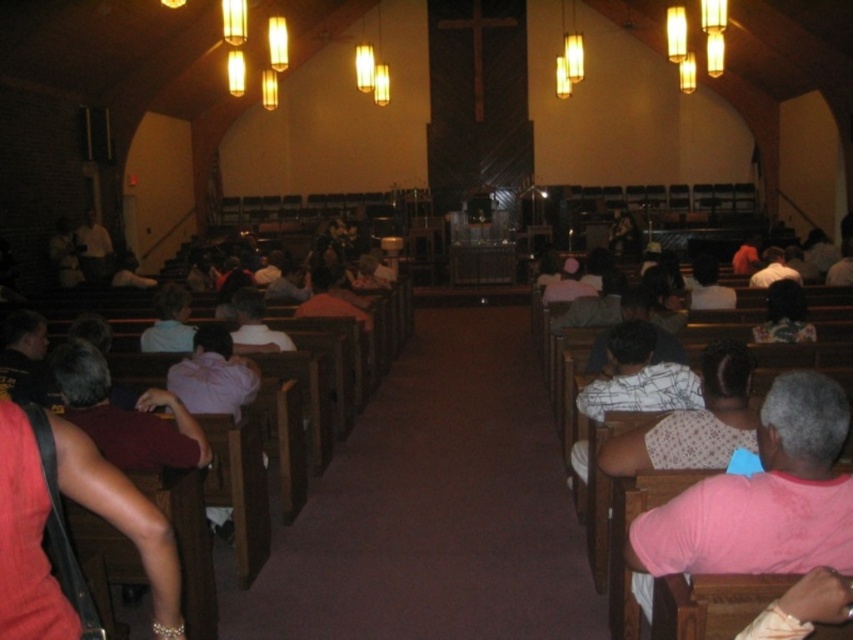
Consider the image. You are a photographer standing at the back of the church and want to take a photo of the two people wearing pink fabric shirts. The left one is wearing a pink fabric shirt at left and the right one is wearing a pink fabric shirt at right. Which person wearing the pink fabric shirt is closer to the front of the church?

The pink fabric shirt at left is much taller than the pink fabric shirt at right, so the person wearing the pink fabric shirt at left is closer to the front of the church.